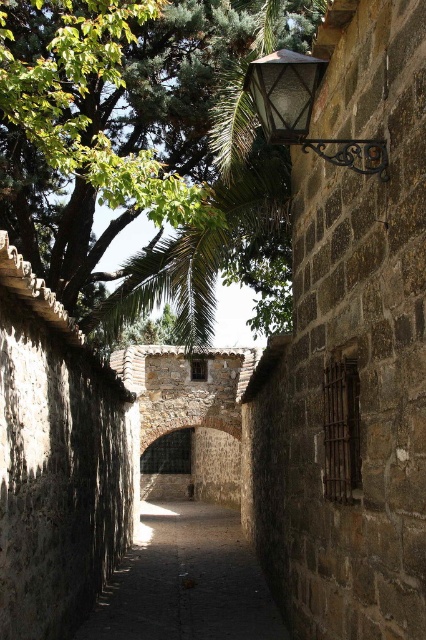
Question: Which of the following is the farthest from the observer?

Choices:
 (A) (242, 620)
 (B) (181, 106)

Answer: (B)

Question: Does dark stone path at center have a smaller size compared to matte glass lamp at upper right?

Choices:
 (A) no
 (B) yes

Answer: (A)

Question: Can you confirm if green leafy tree at upper left is positioned to the right of dark stone path at center?

Choices:
 (A) yes
 (B) no

Answer: (B)

Question: Which of the following is the farthest from the observer?

Choices:
 (A) (304, 28)
 (B) (344, 147)
 (C) (241, 544)

Answer: (C)

Question: Is green leafy tree at upper left bigger than matte glass lamp at upper right?

Choices:
 (A) yes
 (B) no

Answer: (A)

Question: Among these points, which one is farthest from the camera?

Choices:
 (A) (293, 61)
 (B) (51, 125)
 (C) (123, 618)

Answer: (C)